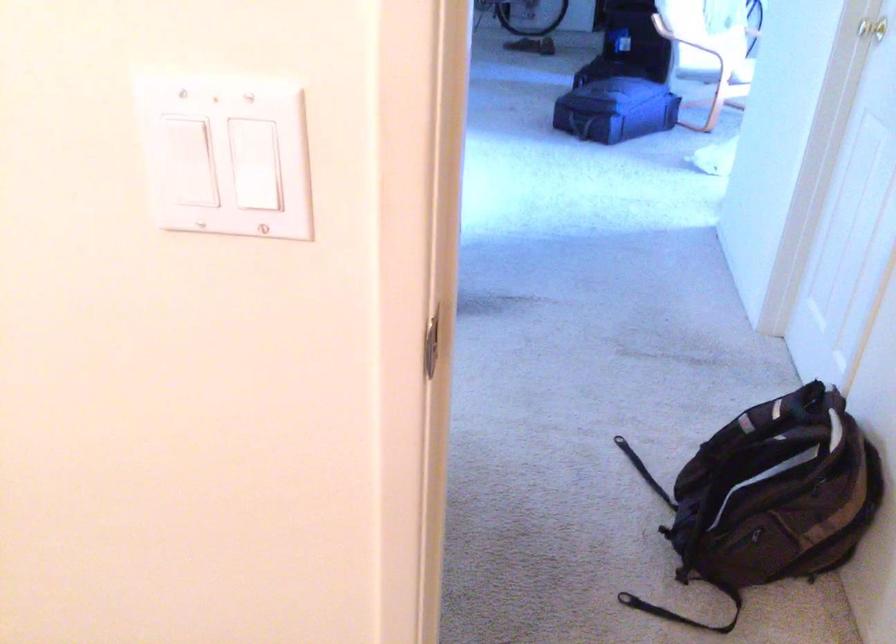
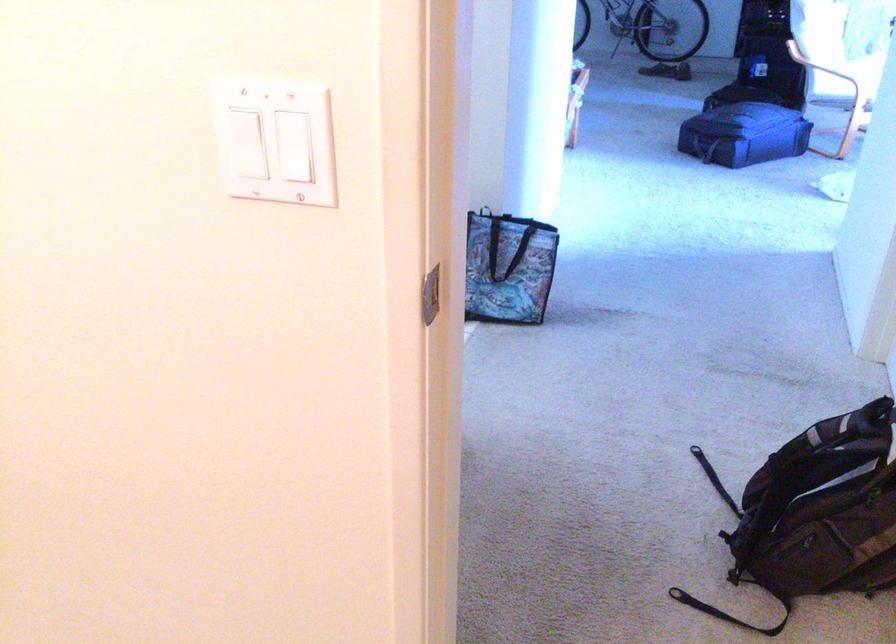
The point at [272,187] is marked in the first image. Where is the corresponding point in the second image?

(294, 146)